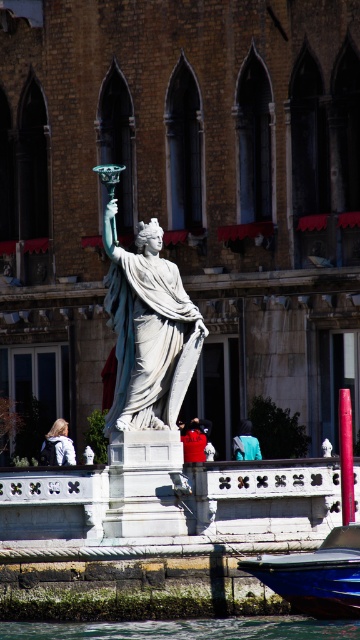
In the scene shown: You are standing in front of the historic building and want to take a photo of the white marble statue at center and the clear water at lower center. Which object is closer to you?

The white marble statue at center is closer to you because the clear water at lower center is behind it.

You are a photographer planning to capture the classical statue and its surroundings. You notice clear water at lower center and a blue glossy boat at lower center in your frame. Which object should you adjust your camera angle to focus on if you want to emphasize the larger object in the scene?

The clear water at lower center has a larger size compared to the blue glossy boat at lower center, so you should adjust your camera angle to focus on the clear water at lower center to emphasize the larger object in the scene.

You are standing in front of the classical statue and want to take a photo. You notice two points marked in the image at coordinates point [165,634] and point [348,611]. Which point is closer to your camera lens?

Point [165,634] is further to the camera than point [348,611], so the point closer to the camera lens is point [348,611].